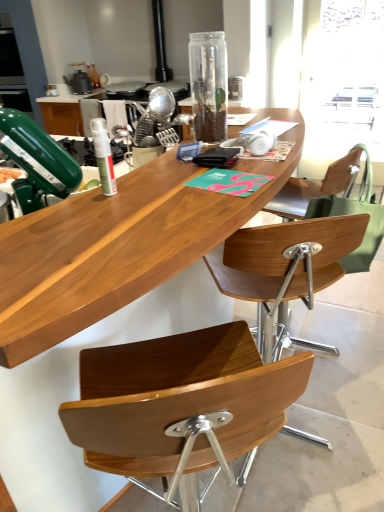
Question: Considering the relative sizes of transparent plastic window screen at upper right and transparent glass bottle at center, placed as the first bottle when sorted from back to front, in the image provided, is transparent plastic window screen at upper right wider than transparent glass bottle at center, placed as the first bottle when sorted from back to front,?

Choices:
 (A) no
 (B) yes

Answer: (A)

Question: Can you confirm if transparent plastic window screen at upper right is thinner than transparent glass bottle at center, the second bottle viewed from the left?

Choices:
 (A) no
 (B) yes

Answer: (B)

Question: Are transparent plastic window screen at upper right and transparent glass bottle at center, placed as the first bottle when sorted from back to front, located far from each other?

Choices:
 (A) no
 (B) yes

Answer: (B)

Question: Does transparent plastic window screen at upper right come in front of transparent glass bottle at center, which ranks as the second bottle in bottom-to-top order?

Choices:
 (A) no
 (B) yes

Answer: (A)

Question: Is transparent plastic window screen at upper right turned away from transparent glass bottle at center, the second bottle viewed from the left?

Choices:
 (A) no
 (B) yes

Answer: (A)

Question: From their relative heights in the image, would you say metallic silver whisk at center, the first appliance in the bottom-to-top sequence, is taller or shorter than wooden chair at center?

Choices:
 (A) tall
 (B) short

Answer: (B)

Question: Considering the positions of metallic silver whisk at center, acting as the second appliance starting from the back, and wooden chair at center in the image, is metallic silver whisk at center, acting as the second appliance starting from the back, bigger or smaller than wooden chair at center?

Choices:
 (A) big
 (B) small

Answer: (B)

Question: Considering the positions of point (140, 130) and point (314, 230), is point (140, 130) closer or farther from the camera than point (314, 230)?

Choices:
 (A) farther
 (B) closer

Answer: (A)

Question: Would you say metallic silver whisk at center, which is the first appliance from front to back, is inside or outside wooden chair at center?

Choices:
 (A) outside
 (B) inside

Answer: (A)

Question: In terms of height, does white matte spray can at center, arranged as the first bottle when ordered from the bottom, look taller or shorter compared to wooden desk at center?

Choices:
 (A) short
 (B) tall

Answer: (A)

Question: Considering the relative positions of white matte spray can at center, which ranks as the second bottle in back-to-front order, and wooden desk at center in the image provided, is white matte spray can at center, which ranks as the second bottle in back-to-front order, to the left or to the right of wooden desk at center?

Choices:
 (A) left
 (B) right

Answer: (B)

Question: In terms of width, does white matte spray can at center, arranged as the first bottle when ordered from the bottom, look wider or thinner when compared to wooden desk at center?

Choices:
 (A) thin
 (B) wide

Answer: (A)

Question: Which is correct: white matte spray can at center, placed as the 1th bottle when sorted from left to right, is inside wooden desk at center, or outside of it?

Choices:
 (A) inside
 (B) outside

Answer: (B)

Question: Considering their positions, is green fabric handbag at right located in front of or behind transparent glass bottle at center, which ranks as the second bottle in bottom-to-top order?

Choices:
 (A) behind
 (B) front

Answer: (A)

Question: Considering the positions of green fabric handbag at right and transparent glass bottle at center, the second bottle viewed from the left, in the image, is green fabric handbag at right bigger or smaller than transparent glass bottle at center, the second bottle viewed from the left,?

Choices:
 (A) big
 (B) small

Answer: (A)